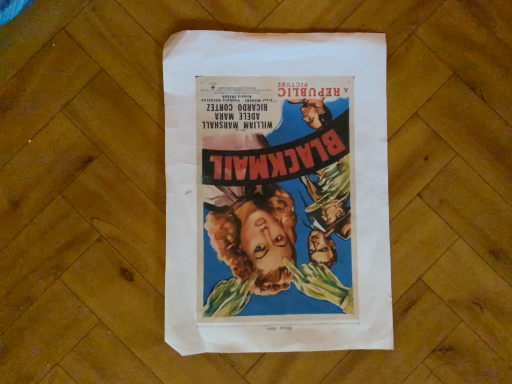
I want to click on empty space that is ontop of vintage paper poster at center, so click(x=278, y=193).